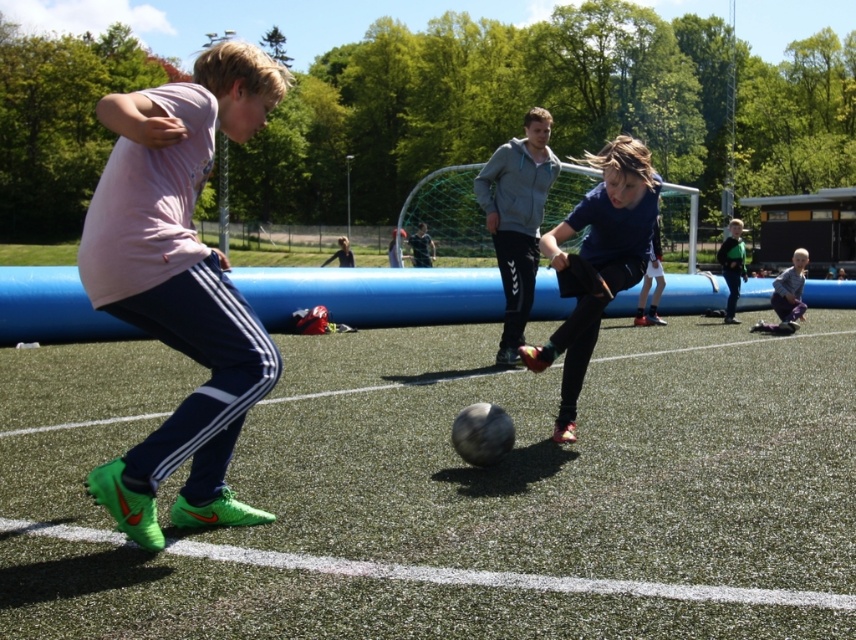
Question: Among these points, which one is farthest from the camera?

Choices:
 (A) (761, 324)
 (B) (651, 163)

Answer: (B)

Question: Is matte blue shorts at center thinner than light blue fabric pants at lower right?

Choices:
 (A) no
 (B) yes

Answer: (B)

Question: Which object appears farthest from the camera in this image?

Choices:
 (A) matte blue shorts at center
 (B) light blue fabric pants at lower right

Answer: (B)

Question: Does matte blue shorts at center appear under light blue fabric pants at lower right?

Choices:
 (A) yes
 (B) no

Answer: (A)

Question: Does matte blue shorts at center have a greater width compared to light blue fabric pants at lower right?

Choices:
 (A) yes
 (B) no

Answer: (B)